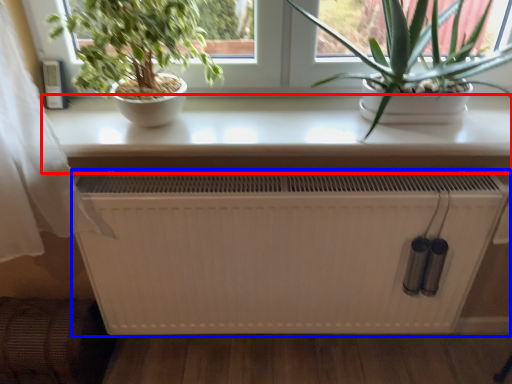
Question: Among these objects, which one is nearest to the camera, table (highlighted by a red box) or heater (highlighted by a blue box)?

Choices:
 (A) table
 (B) heater

Answer: (A)